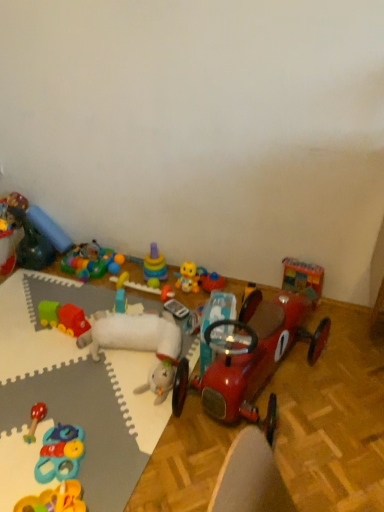
Question: Is rubber duck at upper left, the second toy when ordered from left to right, facing away from blue fabric pillow at upper left, the tenth toy positioned from the right?

Choices:
 (A) yes
 (B) no

Answer: (A)

Question: Is rubber duck at upper left, the 11th toy from the right, shorter than blue fabric pillow at upper left, positioned as the 3th toy in left-to-right order?

Choices:
 (A) no
 (B) yes

Answer: (A)

Question: Can blue fabric pillow at upper left, positioned as the 3th toy in left-to-right order, be found inside rubber duck at upper left, the 11th toy from the right?

Choices:
 (A) no
 (B) yes

Answer: (A)

Question: Is rubber duck at upper left, the second toy when ordered from left to right, positioned behind blue fabric pillow at upper left, positioned as the 3th toy in left-to-right order?

Choices:
 (A) no
 (B) yes

Answer: (A)

Question: Considering the relative sizes of rubber duck at upper left, the 11th toy from the right, and blue fabric pillow at upper left, the tenth toy positioned from the right, in the image provided, is rubber duck at upper left, the 11th toy from the right, bigger than blue fabric pillow at upper left, the tenth toy positioned from the right,?

Choices:
 (A) no
 (B) yes

Answer: (B)

Question: From a real-world perspective, is rubber duck at upper left, the 11th toy from the right, over blue fabric pillow at upper left, the tenth toy positioned from the right?

Choices:
 (A) yes
 (B) no

Answer: (A)

Question: From a real-world perspective, is yellow rubber duck at center, which is the third toy from right to left, under rubberized plastic toy at lower left, placed as the 7th toy when sorted from left to right?

Choices:
 (A) no
 (B) yes

Answer: (A)

Question: Is yellow rubber duck at center, which is the third toy from right to left, turned away from rubberized plastic toy at lower left, marked as the sixth toy in a right-to-left arrangement?

Choices:
 (A) yes
 (B) no

Answer: (B)

Question: Does yellow rubber duck at center, which is the third toy from right to left, have a greater width compared to rubberized plastic toy at lower left, marked as the sixth toy in a right-to-left arrangement?

Choices:
 (A) yes
 (B) no

Answer: (B)

Question: Is rubberized plastic toy at lower left, placed as the 7th toy when sorted from left to right, inside yellow rubber duck at center, which is the third toy from right to left?

Choices:
 (A) yes
 (B) no

Answer: (B)

Question: Considering the relative sizes of yellow rubber duck at center, which is the third toy from right to left, and rubberized plastic toy at lower left, marked as the sixth toy in a right-to-left arrangement, in the image provided, is yellow rubber duck at center, which is the third toy from right to left, thinner than rubberized plastic toy at lower left, marked as the sixth toy in a right-to-left arrangement,?

Choices:
 (A) yes
 (B) no

Answer: (A)

Question: Is yellow rubber duck at center, which ranks as the tenth toy in left-to-right order, far from rubberized plastic toy at lower left, marked as the sixth toy in a right-to-left arrangement?

Choices:
 (A) yes
 (B) no

Answer: (B)

Question: Is rubberized plastic rings at center, the 9th toy viewed from the left, wider than yellow rubber duck at center, which is the third toy from right to left?

Choices:
 (A) yes
 (B) no

Answer: (B)